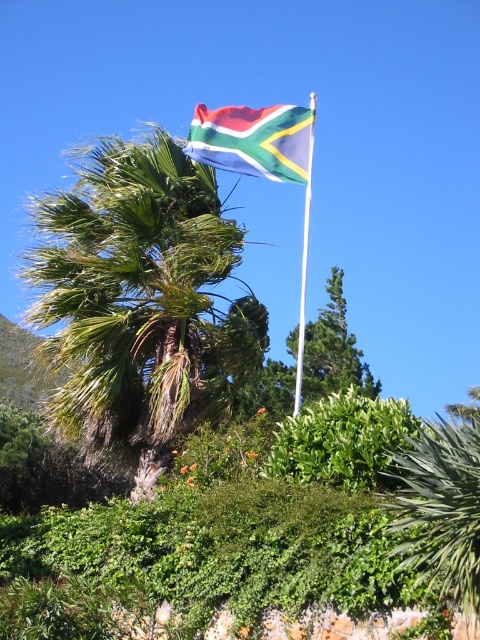
Question: Can you confirm if green leafy palm at upper center is positioned to the left of white metallic pole at upper center?

Choices:
 (A) yes
 (B) no

Answer: (A)

Question: Is green leafy palm at upper center wider than polyester flag at upper center?

Choices:
 (A) no
 (B) yes

Answer: (B)

Question: In this image, where is polyester flag at upper center located relative to green leafy tree at center?

Choices:
 (A) left
 (B) right

Answer: (A)

Question: Among these objects, which one is nearest to the camera?

Choices:
 (A) green leafy tree at center
 (B) polyester flag at upper center

Answer: (B)

Question: Which is nearer to the green leafy palm at upper center?

Choices:
 (A) green leafy tree at center
 (B) white metallic pole at upper center
 (C) polyester flag at upper center

Answer: (C)

Question: Which is nearer to the polyester flag at upper center?

Choices:
 (A) green leafy palm at upper center
 (B) white metallic pole at upper center

Answer: (A)